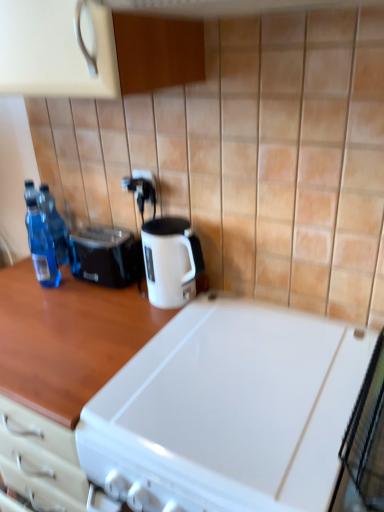
Question: In which direction should I rotate to look at woodenmaterial/texturecountertop at center, arranged as the 2th countertop when viewed from the right?

Choices:
 (A) left
 (B) right

Answer: (A)

Question: Is transparent plastic bottles at left, positioned as the second bottle in back-to-front order, looking in the opposite direction of transparent plastic bottles at left, arranged as the first bottle when viewed from the back?

Choices:
 (A) no
 (B) yes

Answer: (A)

Question: Does transparent plastic bottles at left, positioned as the second bottle in back-to-front order, have a lesser height compared to transparent plastic bottles at left, marked as the second bottle in a front-to-back arrangement?

Choices:
 (A) no
 (B) yes

Answer: (A)

Question: Does transparent plastic bottles at left, which is the first bottle from front to back, turn towards transparent plastic bottles at left, marked as the second bottle in a front-to-back arrangement?

Choices:
 (A) yes
 (B) no

Answer: (B)

Question: From the image's perspective, would you say transparent plastic bottles at left, positioned as the second bottle in back-to-front order, is positioned over transparent plastic bottles at left, marked as the second bottle in a front-to-back arrangement?

Choices:
 (A) yes
 (B) no

Answer: (B)

Question: Can you confirm if transparent plastic bottles at left, positioned as the second bottle in back-to-front order, is smaller than transparent plastic bottles at left, marked as the second bottle in a front-to-back arrangement?

Choices:
 (A) no
 (B) yes

Answer: (B)

Question: From a real-world perspective, is transparent plastic bottles at left, which is the first bottle from front to back, physically below transparent plastic bottles at left, marked as the second bottle in a front-to-back arrangement?

Choices:
 (A) no
 (B) yes

Answer: (A)

Question: From a real-world perspective, is woodenmaterial/texturecountertop at center, marked as the first countertop in a left-to-right arrangement, positioned over transparent plastic bottles at left, which is the first bottle from front to back, based on gravity?

Choices:
 (A) no
 (B) yes

Answer: (A)

Question: Considering the relative sizes of woodenmaterial/texturecountertop at center, arranged as the 2th countertop when viewed from the right, and transparent plastic bottles at left, positioned as the second bottle in back-to-front order, in the image provided, is woodenmaterial/texturecountertop at center, arranged as the 2th countertop when viewed from the right, taller than transparent plastic bottles at left, positioned as the second bottle in back-to-front order,?

Choices:
 (A) no
 (B) yes

Answer: (B)

Question: From a real-world perspective, is woodenmaterial/texturecountertop at center, marked as the first countertop in a left-to-right arrangement, positioned under transparent plastic bottles at left, which is the first bottle from front to back, based on gravity?

Choices:
 (A) yes
 (B) no

Answer: (A)

Question: From the image's perspective, does woodenmaterial/texturecountertop at center, arranged as the 2th countertop when viewed from the right, appear higher than transparent plastic bottles at left, which is the first bottle from front to back?

Choices:
 (A) yes
 (B) no

Answer: (B)

Question: Would you say woodenmaterial/texturecountertop at center, arranged as the 2th countertop when viewed from the right, is outside transparent plastic bottles at left, positioned as the second bottle in back-to-front order?

Choices:
 (A) no
 (B) yes

Answer: (B)

Question: Considering the relative positions of woodenmaterial/texturecountertop at center, marked as the first countertop in a left-to-right arrangement, and transparent plastic bottles at left, which is the first bottle from front to back, in the image provided, is woodenmaterial/texturecountertop at center, marked as the first countertop in a left-to-right arrangement, to the right of transparent plastic bottles at left, which is the first bottle from front to back, from the viewer's perspective?

Choices:
 (A) no
 (B) yes

Answer: (B)

Question: Can you confirm if white plastic electric outlet at center, the first electric outlet ordered from the bottom, is smaller than black plastic toaster at left?

Choices:
 (A) yes
 (B) no

Answer: (A)